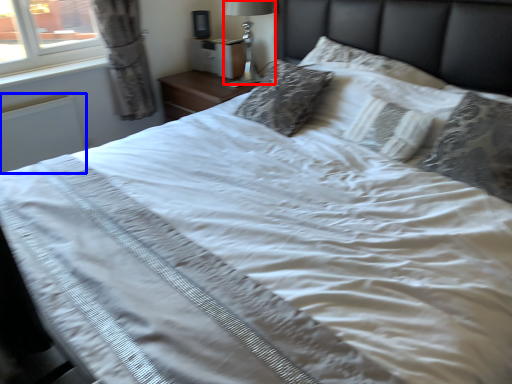
Question: Among these objects, which one is nearest to the camera, bedside lamp (highlighted by a red box) or radiator (highlighted by a blue box)?

Choices:
 (A) bedside lamp
 (B) radiator

Answer: (B)